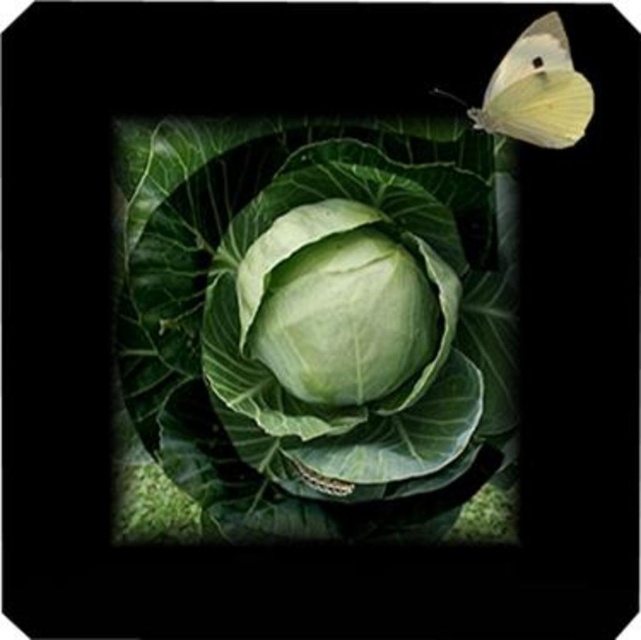
Question: Can you confirm if green smooth leafy vegetable at center is thinner than green matte cabbage at center?

Choices:
 (A) yes
 (B) no

Answer: (B)

Question: Does green smooth leafy vegetable at center have a larger size compared to green matte cabbage at center?

Choices:
 (A) no
 (B) yes

Answer: (B)

Question: Estimate the real-world distances between objects in this image. Which object is farther from the translucent yellow butterfly at upper right?

Choices:
 (A) green smooth leafy vegetable at center
 (B) green matte cabbage at center

Answer: (B)

Question: Does green matte cabbage at center appear over translucent yellow butterfly at upper right?

Choices:
 (A) yes
 (B) no

Answer: (B)

Question: Which object is the farthest from the green matte cabbage at center?

Choices:
 (A) green smooth leafy vegetable at center
 (B) translucent yellow butterfly at upper right

Answer: (B)

Question: Which of the following is the farthest from the observer?

Choices:
 (A) (503, 81)
 (B) (287, 387)
 (C) (420, 182)

Answer: (B)